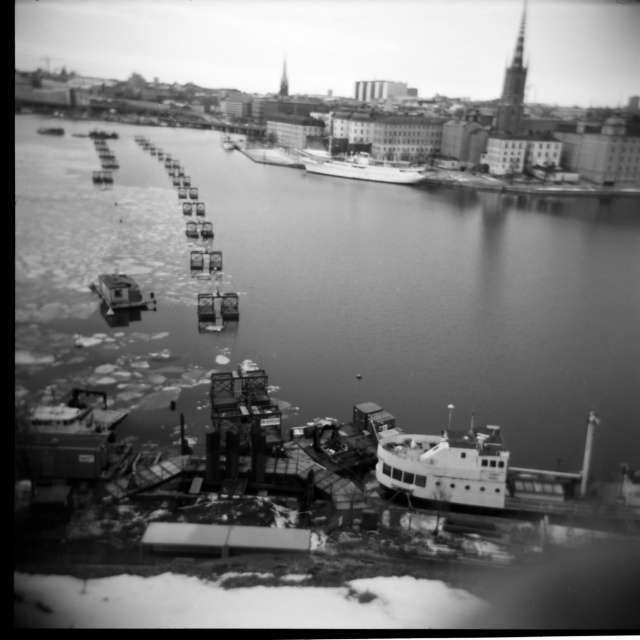
Looking at this image, you are a photographer planning to capture the waterfront scene. You want to ensure both the smooth wood dock at center and the white matte boat at center are clearly visible in your shot. Given their sizes, which object should you position closer to the camera to maintain clarity?

The smooth wood dock at center is shorter than the white matte boat at center. To maintain clarity for both, position the white matte boat at center closer to the camera since it is larger and might require more focus area.

You are a harbor worker who needs to determine which vessel is longer. You see the white matte boat at lower right and the smooth white ship at center. Which one is longer?

The smooth white ship at center is longer than the white matte boat at lower right.